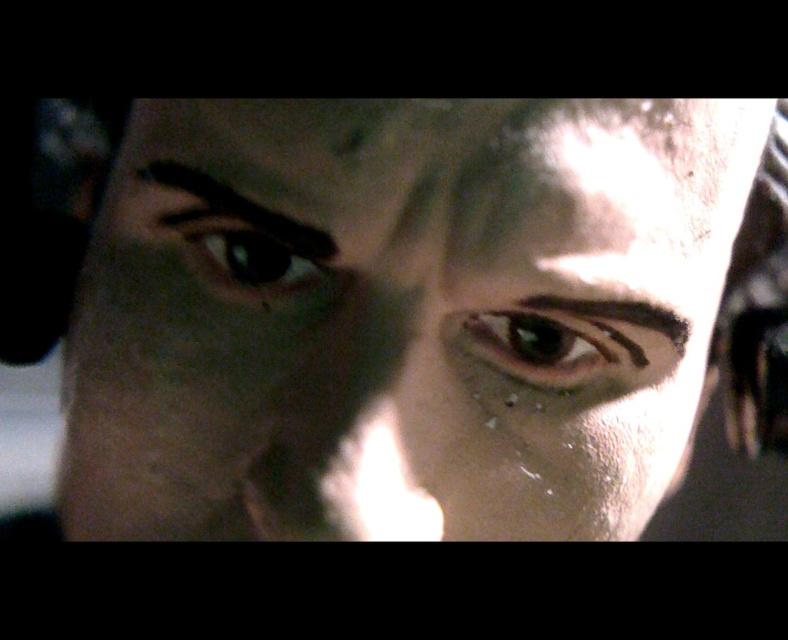
You are a photographer adjusting the focus of your camera. You want to ensure both the slick skin face at center and the brown matte eyebrow at center are in sharp focus. Is it possible to focus on both simultaneously?

The slick skin face at center is in front of the brown matte eyebrow at center, so focusing on both simultaneously may be challenging due to their different distances from the camera. Adjust the focus to the closer object, the slick skin face at center, for optimal sharpness.